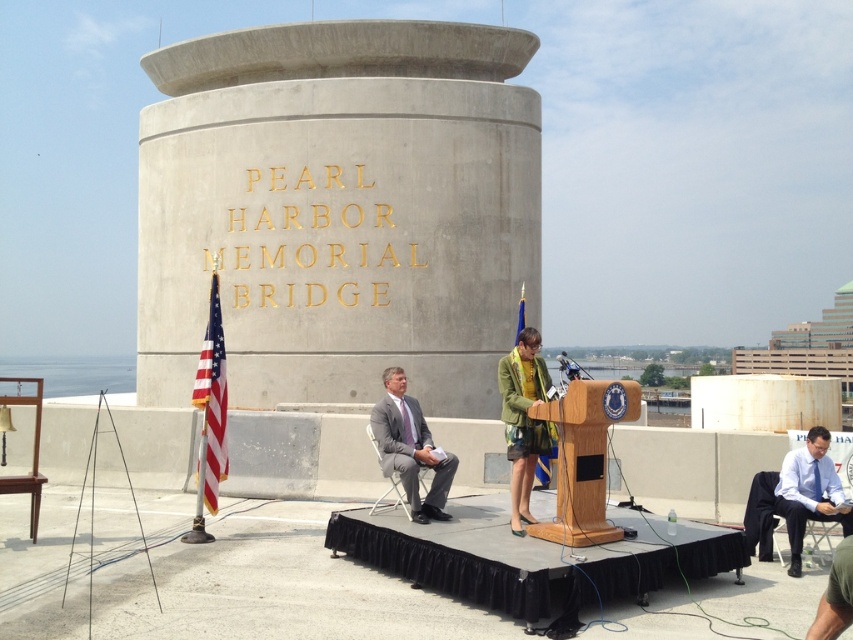
You are attending the event at the Pearl Harbor Memorial Bridge and notice two items at the center of the image. Which one is wider, the concrete gold lettering at center or the gray matte suit at center?

The concrete gold lettering at center is wider than the gray matte suit at center according to the description.

You are attending an event at the Pearl Harbor Memorial Bridge and notice a specific point marked at coordinates (339, 209). What object is located at this point?

The object at point (339, 209) is the concrete gold lettering at center.